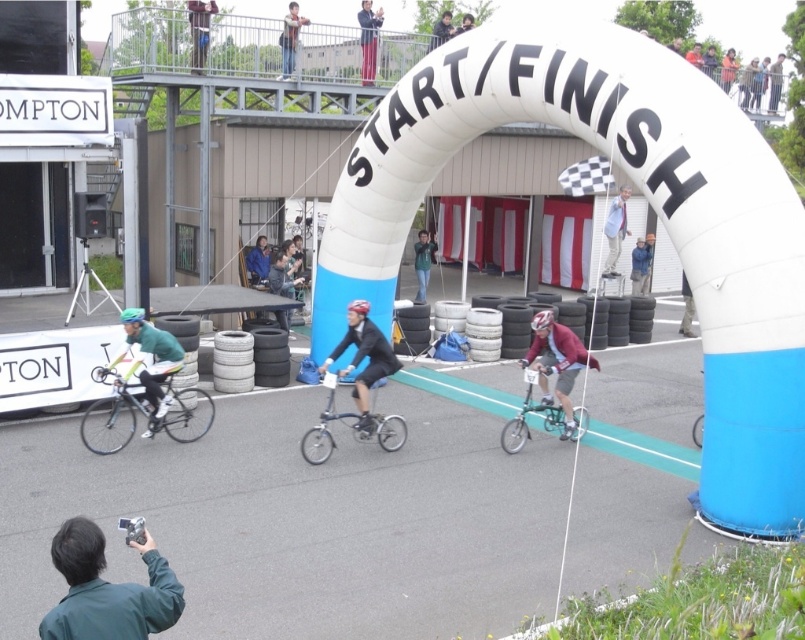
Is green matte bicycle helmet at center above dark blue helmet at center?

No, green matte bicycle helmet at center is not above dark blue helmet at center.

Does green matte bicycle helmet at center appear on the right side of dark blue helmet at center?

No, green matte bicycle helmet at center is not to the right of dark blue helmet at center.

Is point (130, 308) closer to viewer compared to point (464, 28)?

Yes, it is.

Where is `green matte bicycle helmet at center`? Image resolution: width=805 pixels, height=640 pixels. green matte bicycle helmet at center is located at coordinates (131, 314).

Consider the image. Does metallic blue bicycle at center appear under red pants at upper center?

Indeed, metallic blue bicycle at center is positioned under red pants at upper center.

Locate an element on the screen. The height and width of the screenshot is (640, 805). metallic blue bicycle at center is located at coordinates (349, 428).

Measure the distance between point (x=362, y=435) and camera.

Point (x=362, y=435) is 9.66 meters away from camera.

Find the location of a particular element. Image resolution: width=805 pixels, height=640 pixels. metallic blue bicycle at center is located at coordinates (349, 428).

Can you confirm if green matte jacket at lower left is wider than light blue denim jacket at upper center?

No.

Does green matte jacket at lower left have a smaller size compared to light blue denim jacket at upper center?

Yes, green matte jacket at lower left is smaller than light blue denim jacket at upper center.

Where is `green matte jacket at lower left`? This screenshot has height=640, width=805. green matte jacket at lower left is located at coordinates (106, 589).

I want to click on green matte jacket at lower left, so click(x=106, y=589).